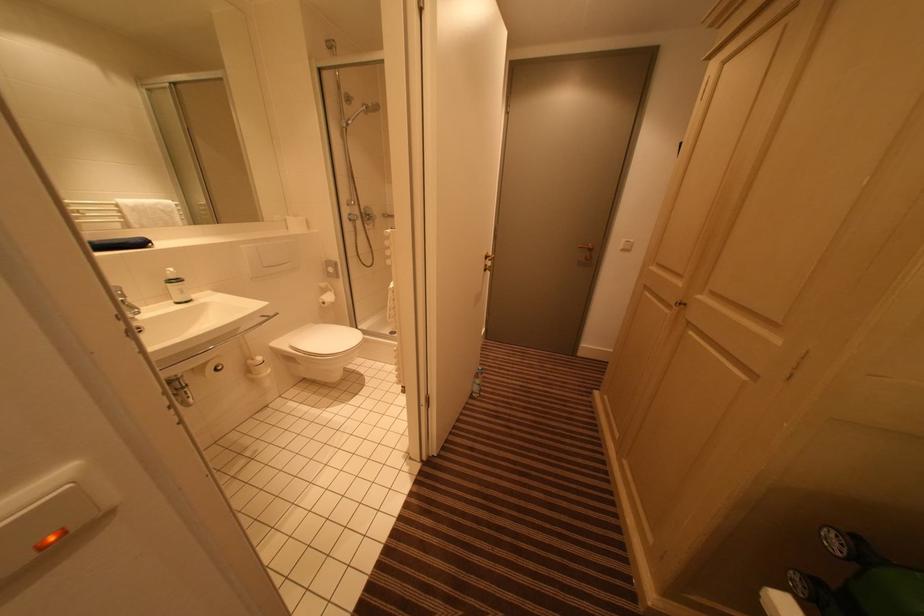
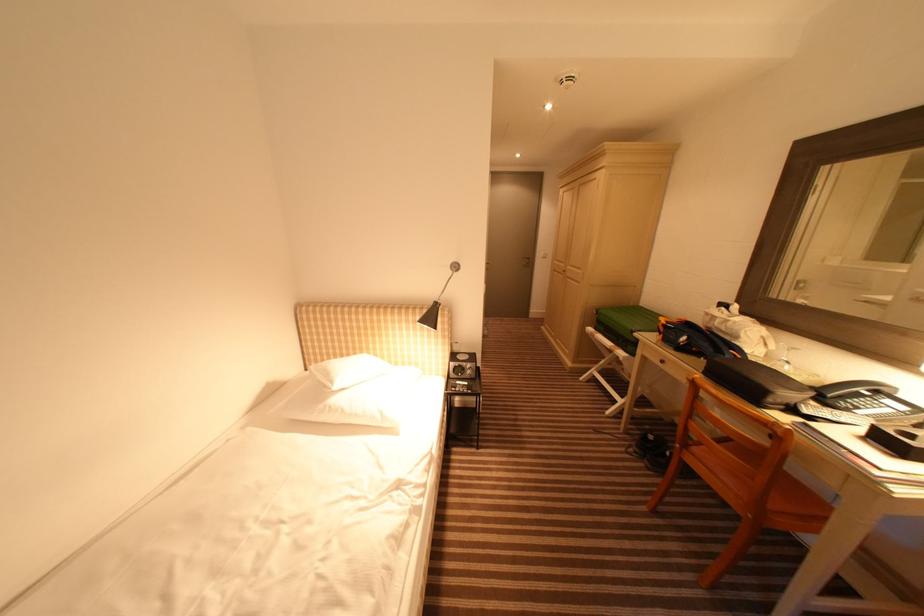
Which direction would the cameraman need to move to produce the second image?

The cameraman walked toward left, backward.